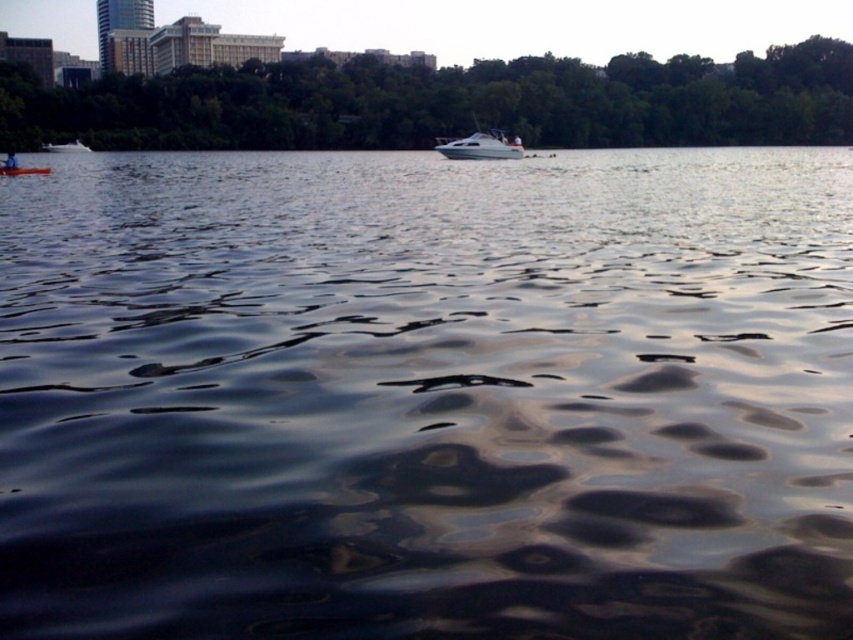
Question: Which point is closer to the camera?

Choices:
 (A) orange plastic kayak at lower left
 (B) green leafy trees at upper center
 (C) white glossy boat at center

Answer: (A)

Question: Can you confirm if white glossy boat at center is wider than orange plastic kayak at lower left?

Choices:
 (A) no
 (B) yes

Answer: (B)

Question: Among these points, which one is farthest from the camera?

Choices:
 (A) (772, 54)
 (B) (47, 172)
 (C) (515, 156)

Answer: (A)

Question: Observing the image, what is the correct spatial positioning of green leafy trees at upper center in reference to orange plastic kayak at lower left?

Choices:
 (A) right
 (B) left

Answer: (A)

Question: Where is green leafy trees at upper center located in relation to orange plastic kayak at lower left in the image?

Choices:
 (A) below
 (B) above

Answer: (B)

Question: Among these points, which one is farthest from the camera?

Choices:
 (A) (825, 49)
 (B) (479, 156)
 (C) (44, 166)

Answer: (A)